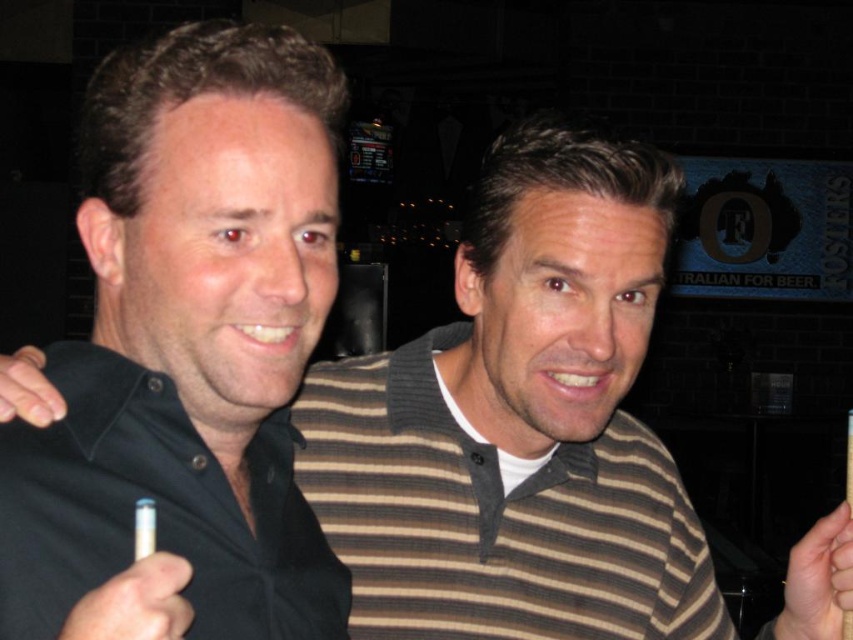
Question: Observing the image, what is the correct spatial positioning of black cotton polo shirt at left in reference to white paper cigarette at lower left?

Choices:
 (A) below
 (B) above

Answer: (A)

Question: Can you confirm if black cotton polo shirt at left is smaller than white paper cigarette at lower left?

Choices:
 (A) no
 (B) yes

Answer: (A)

Question: Which point is farther from the camera taking this photo?

Choices:
 (A) (144, 392)
 (B) (134, 516)

Answer: (A)

Question: Is black cotton polo shirt at left closer to the viewer compared to white paper cigarette at lower left?

Choices:
 (A) yes
 (B) no

Answer: (B)

Question: Which of the following is the farthest from the observer?

Choices:
 (A) (142, 554)
 (B) (134, 424)

Answer: (B)